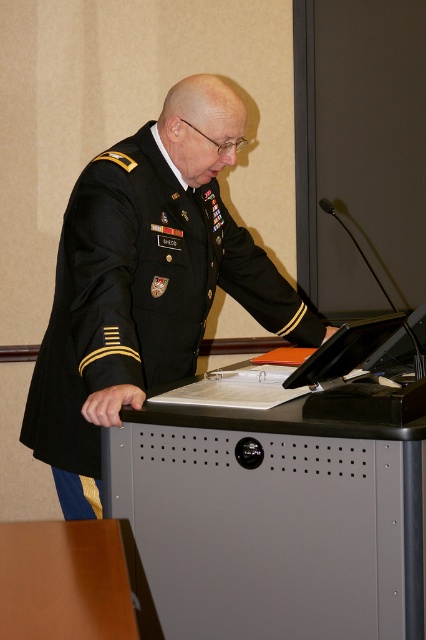
You are a photographer setting up for a formal portrait. You need to ensure that the metallic gray table at center and the black matte military uniform at center are both in focus. Given that your camera has a depth of field that can cover objects within a 15 inch range, will you need to adjust your settings to include both?

The metallic gray table at center is 16.50 inches away from the black matte military uniform at center. Since the distance exceeds the 15 inch depth of field range, you will need to adjust your camera settings to ensure both are in focus.

Based on the photo, based on the scene, where is the metallic gray table at center located relative to the black matte military uniform at center?

The metallic gray table at center is to the right of the black matte military uniform at center.